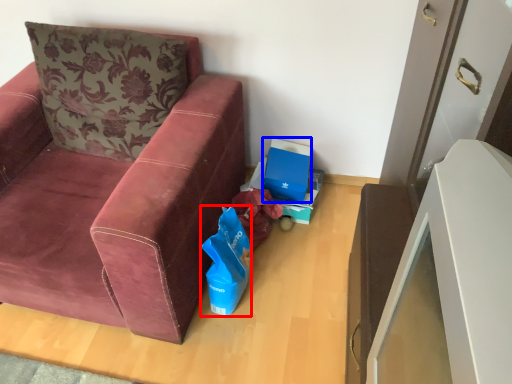
Question: Which object is closer to the camera taking this photo, gift bag (highlighted by a red box) or cardboard box (highlighted by a blue box)?

Choices:
 (A) gift bag
 (B) cardboard box

Answer: (A)